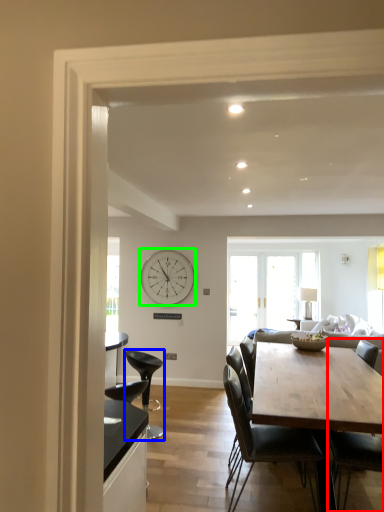
Question: Estimate the real-world distances between objects in this image. Which object is farther from chair (highlighted by a red box), chair (highlighted by a blue box) or clock (highlighted by a green box)?

Choices:
 (A) chair
 (B) clock

Answer: (B)